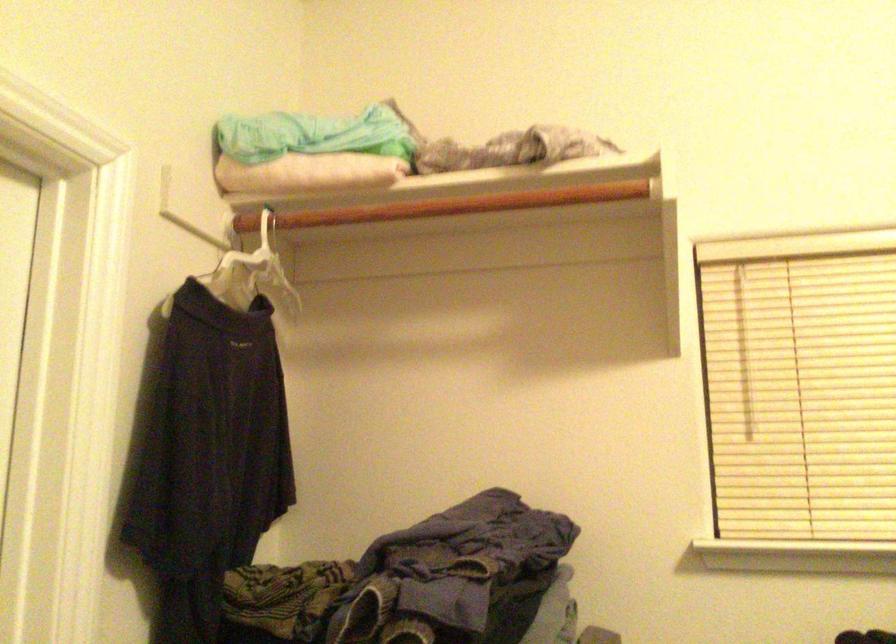
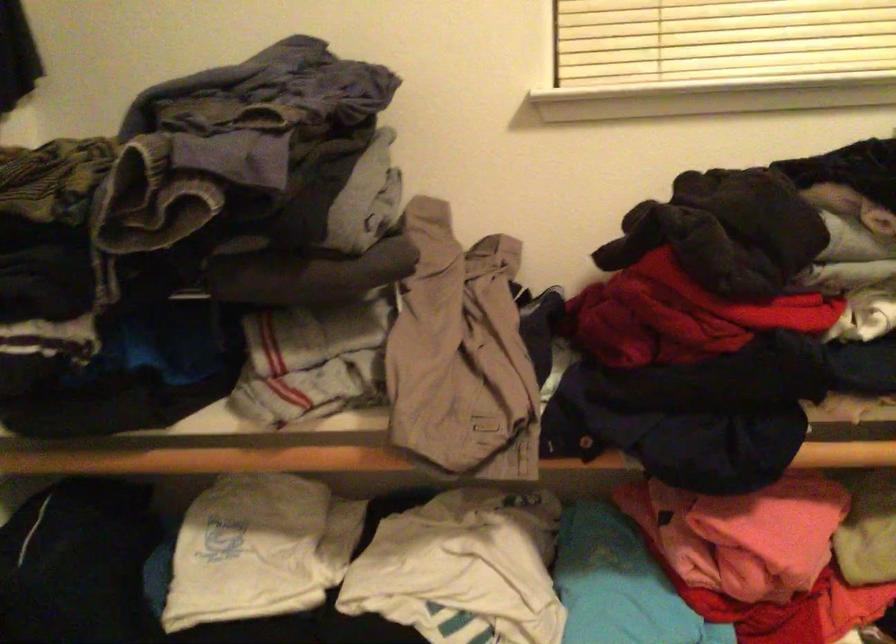
Question: Based on the continuous images, in which direction is the camera rotating? Reply with the corresponding letter.

Choices:
 (A) Left
 (B) Right
 (C) Up
 (D) Down

Answer: (D)